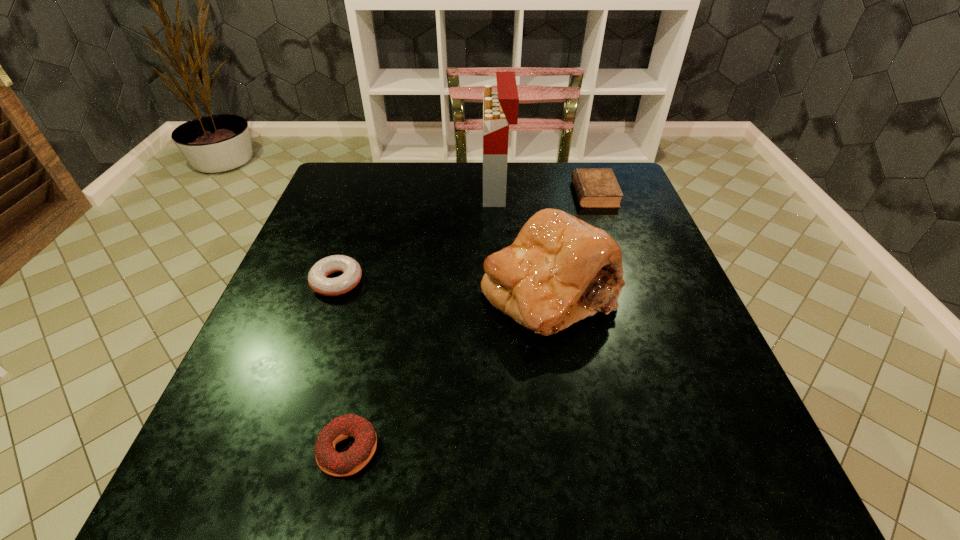
You are a GUI agent. You are given a task and a screenshot of the screen. Output one action in this format:
    pyautogui.click(x=<x>, y=<y>)
    Task: Click on the bread that is at the right edge
    
    Given the screenshot: What is the action you would take?
    pyautogui.click(x=559, y=270)

The height and width of the screenshot is (540, 960). I want to click on diary that is at the right edge, so click(595, 187).

Where is `object that is at the far right corner`? Image resolution: width=960 pixels, height=540 pixels. object that is at the far right corner is located at coordinates (595, 187).

In the image, there is a desktop. Identify the location of vacant area at the far edge. Image resolution: width=960 pixels, height=540 pixels. (419, 168).

Find the location of a particular element. vacant space at the near edge is located at coordinates (371, 461).

Find the location of a particular element. vacant space at the left edge of the desktop is located at coordinates (264, 365).

Where is `vacant space at the right edge of the desktop`? The width and height of the screenshot is (960, 540). vacant space at the right edge of the desktop is located at coordinates (690, 409).

In the image, there is a desktop. Identify the location of free space at the far left corner. The image size is (960, 540). (345, 171).

Image resolution: width=960 pixels, height=540 pixels. What are the coordinates of `free space between the right doughnut and the cigarette case` in the screenshot? It's located at (422, 319).

This screenshot has width=960, height=540. I want to click on free area in between the nearest object and the farther doughnut, so click(x=343, y=366).